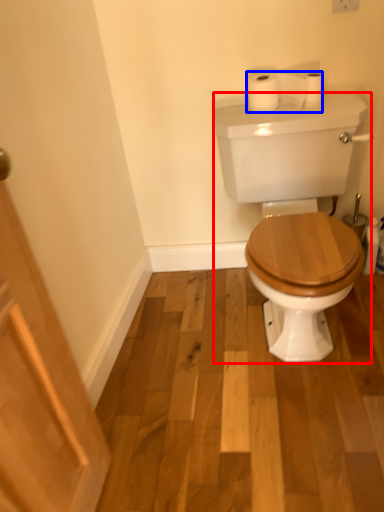
Question: Which point is closer to the camera, porcelain (highlighted by a red box) or toilet paper (highlighted by a blue box)?

Choices:
 (A) porcelain
 (B) toilet paper

Answer: (A)